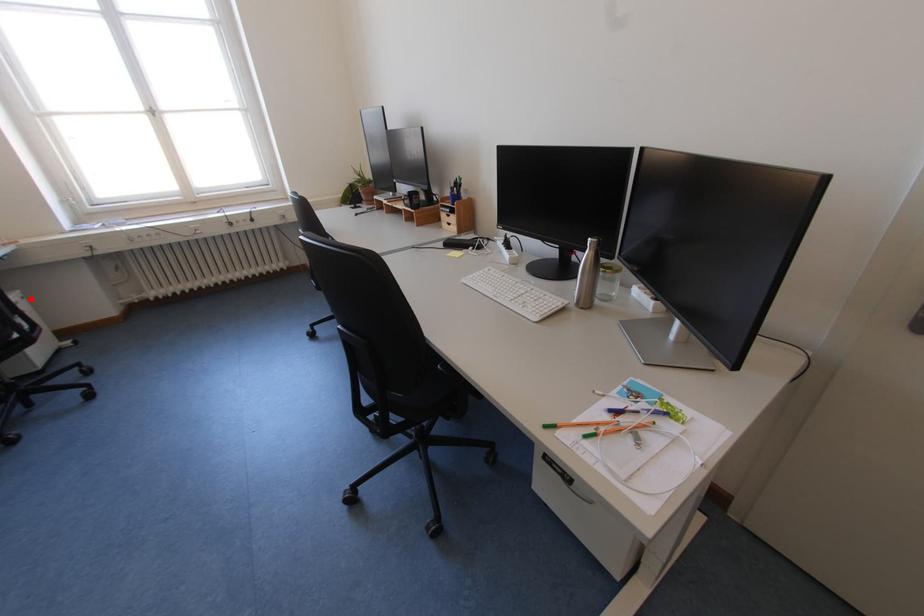
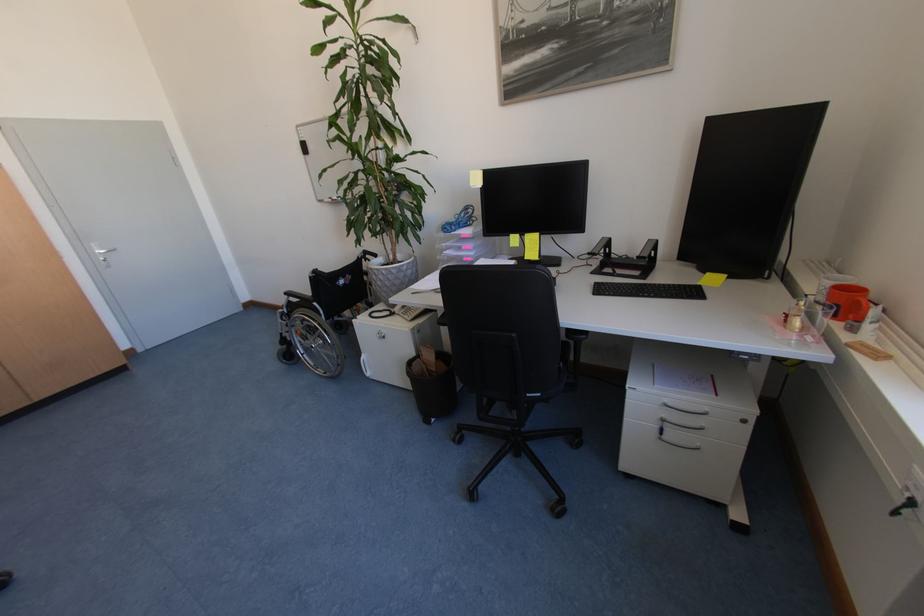
Question: I am providing you with two images of the same scene from different viewpoints. Given a red point in image1, look at the same physical point in image2. Is it:

Choices:
 (A) Closer to the viewpoint
 (B) Farther from the viewpoint

Answer: (A)